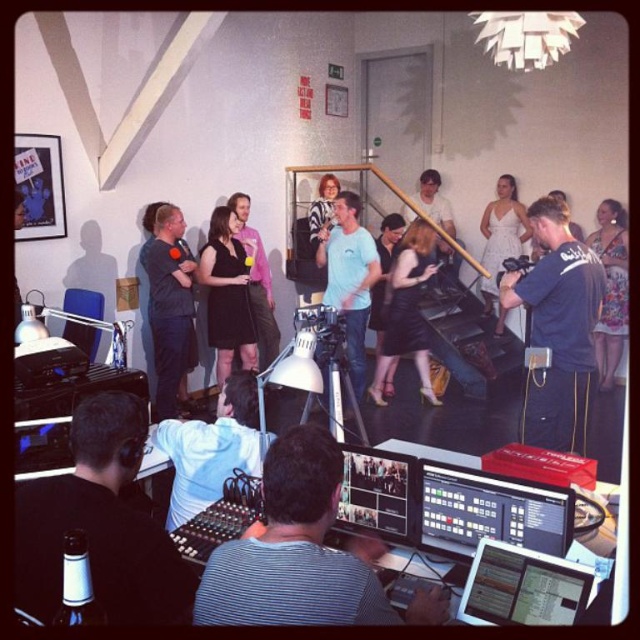
Locate an element on the screen. The image size is (640, 640). striped shirt at center is located at coordinates (301, 554).

Does striped shirt at center lie in front of floral dress at center?

Yes, striped shirt at center is closer to the viewer.

Which is in front, point (353, 563) or point (618, 278)?

Point (353, 563) is in front.

At what (x,y) coordinates should I click in order to perform the action: click on striped shirt at center. Please return your answer as a coordinate pair (x, y). Looking at the image, I should click on (301, 554).

Between dark blue shirt at center and black leather dress at center, which one appears on the right side from the viewer's perspective?

black leather dress at center

Which is behind, point (160, 280) or point (429, 272)?

The point (429, 272) is behind.

Image resolution: width=640 pixels, height=640 pixels. I want to click on dark blue shirt at center, so click(170, 307).

Who is more distant from viewer, (164, 317) or (481, 282)?

Positioned behind is point (481, 282).

Is point (154, 250) more distant than point (509, 182)?

No, (154, 250) is in front of (509, 182).

I want to click on dark blue shirt at center, so click(170, 307).